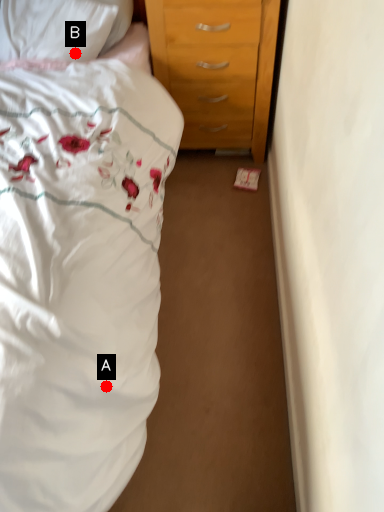
Question: Two points are circled on the image, labeled by A and B beside each circle. Which point is farther from the camera taking this photo?

Choices:
 (A) A is further
 (B) B is further

Answer: (B)